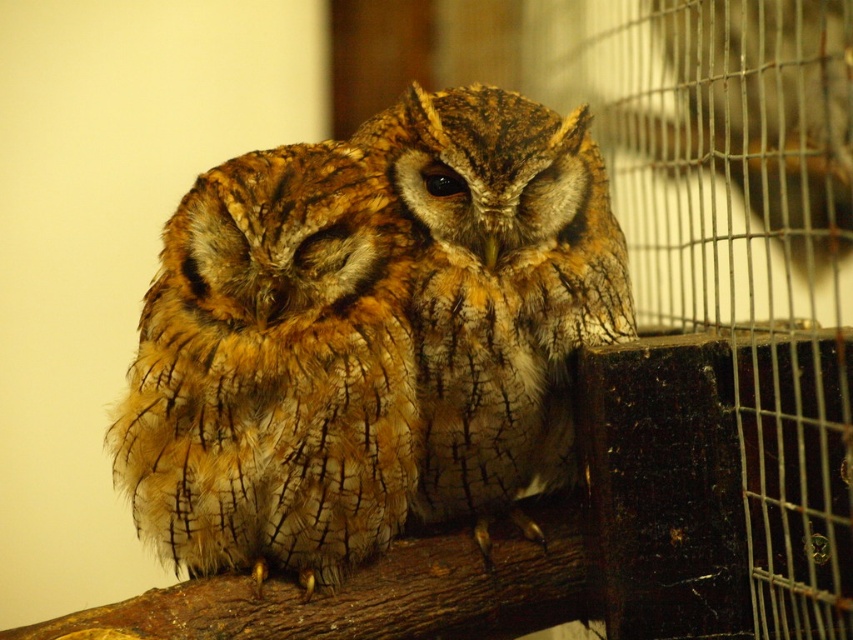
You are a zookeeper observing two owls in their enclosure. You notice the brown textured owl at center and the brown speckled owl at center. Which of these two owls is positioned to the left side of the other?

The brown textured owl at center is positioned to the left of the brown speckled owl at center.

You are a zookeeper observing the owls in their enclosure. You notice a specific point marked at coordinates (276,369). Which owl does this point correspond to?

The point at coordinates (276,369) corresponds to the brown textured owl at center.

You are a zookeeper who needs to measure the distance between the two owls perched on the branch. According to the scene, how far apart are the brown textured owl at center and the brown speckled owl at center?

The brown textured owl at center and brown speckled owl at center are 6.87 inches apart.